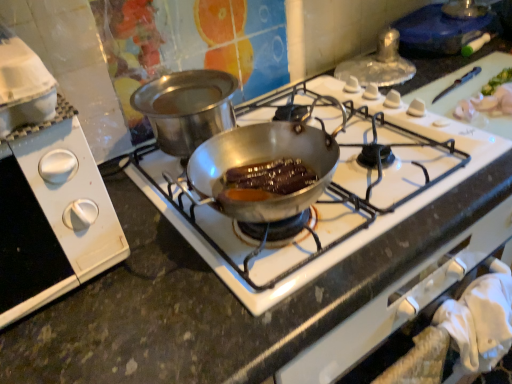
Question: Is white plastic stove knobs at left completely or partially outside of shiny silver pan at center?

Choices:
 (A) no
 (B) yes

Answer: (B)

Question: Considering the relative sizes of white plastic stove knobs at left and shiny silver pan at center in the image provided, is white plastic stove knobs at left wider than shiny silver pan at center?

Choices:
 (A) no
 (B) yes

Answer: (A)

Question: Is shiny silver pan at center inside white plastic stove knobs at left?

Choices:
 (A) yes
 (B) no

Answer: (B)

Question: Is white plastic stove knobs at left positioned before shiny silver pan at center?

Choices:
 (A) no
 (B) yes

Answer: (B)

Question: Is white plastic stove knobs at left to the right of shiny silver pan at center from the viewer's perspective?

Choices:
 (A) no
 (B) yes

Answer: (A)

Question: Does white plastic stove knobs at left have a lesser width compared to shiny silver pan at center?

Choices:
 (A) no
 (B) yes

Answer: (B)

Question: Is shiny silver pan at center not close to white plastic stove knobs at left?

Choices:
 (A) yes
 (B) no

Answer: (B)

Question: Is shiny silver pan at center shorter than white plastic stove knobs at left?

Choices:
 (A) yes
 (B) no

Answer: (A)

Question: Is shiny silver pan at center with white plastic stove knobs at left?

Choices:
 (A) no
 (B) yes

Answer: (A)

Question: Is shiny silver pan at center positioned before white plastic stove knobs at left?

Choices:
 (A) yes
 (B) no

Answer: (B)

Question: From a real-world perspective, is shiny silver pan at center over white plastic stove knobs at left?

Choices:
 (A) no
 (B) yes

Answer: (A)

Question: Is shiny silver pan at center thinner than white plastic stove knobs at left?

Choices:
 (A) no
 (B) yes

Answer: (A)

Question: In terms of height, does shiny silver pan at center look taller or shorter compared to white plastic stove knobs at left?

Choices:
 (A) tall
 (B) short

Answer: (B)